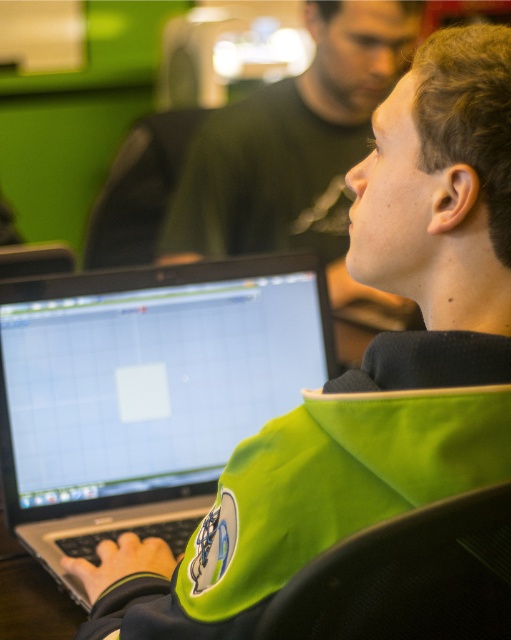
You are trying to determine the relative thickness of the silver metallic laptop at center and the green matte jacket at upper center in the image. Based on the scene, which object is thinner?

The silver metallic laptop at center is thinner than the green matte jacket at upper center.

You are a delivery person who needs to place a box on the desk between the silver metallic laptop at center and the green matte jacket at upper center. Can the box fit vertically between them?

The silver metallic laptop at center is shorter than green matte jacket at upper center, so the vertical space between them may be sufficient for the box. However, without knowing the exact height of the box, it is difficult to confirm. Please measure the box and ensure it does not exceed the available vertical space between the two objects.